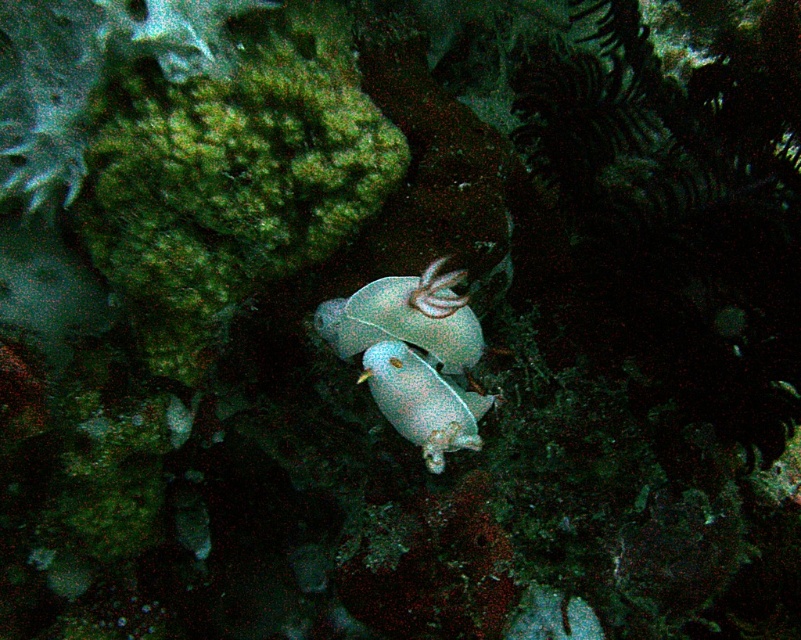
Question: Does translucent blue shell at center have a larger size compared to translucent white fish at center?

Choices:
 (A) no
 (B) yes

Answer: (A)

Question: Among these points, which one is farthest from the camera?

Choices:
 (A) (355, 301)
 (B) (373, 365)

Answer: (A)

Question: Which object is farther from the camera taking this photo?

Choices:
 (A) translucent blue shell at center
 (B) translucent white fish at center

Answer: (B)

Question: Which point is farther to the camera?

Choices:
 (A) translucent blue shell at center
 (B) translucent white fish at center

Answer: (B)

Question: Does translucent blue shell at center have a larger size compared to translucent white fish at center?

Choices:
 (A) no
 (B) yes

Answer: (A)

Question: Does translucent blue shell at center have a lesser width compared to translucent white fish at center?

Choices:
 (A) yes
 (B) no

Answer: (B)